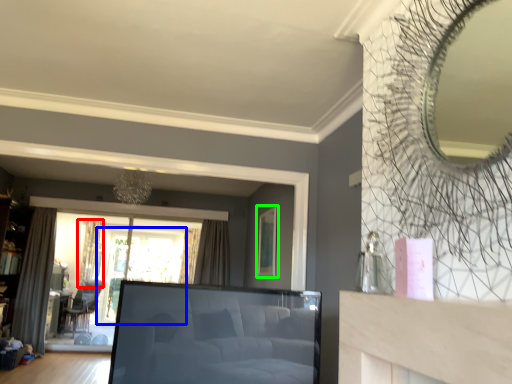
Question: Which object is the farthest from curtain (highlighted by a red box)? Choose among these: window screen (highlighted by a blue box) or picture frame (highlighted by a green box).

Choices:
 (A) window screen
 (B) picture frame

Answer: (B)